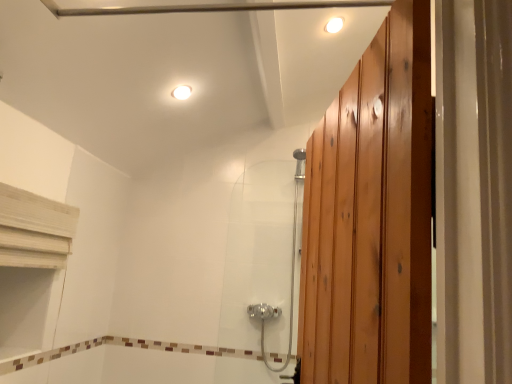
This screenshot has width=512, height=384. What do you see at coordinates (181, 92) in the screenshot? I see `white glossy light fixture at upper center, which ranks as the second light fixture in top-to-bottom order` at bounding box center [181, 92].

What do you see at coordinates (334, 25) in the screenshot?
I see `white glossy light fixture at upper center, the first light fixture in the right-to-left sequence` at bounding box center [334, 25].

Where is `satin chrome shower door at center`? The width and height of the screenshot is (512, 384). satin chrome shower door at center is located at coordinates (262, 254).

From the image's perspective, is white glossy light fixture at upper center, positioned as the 2th light fixture in right-to-left order, beneath white glossy light fixture at upper center, placed as the second light fixture when sorted from left to right?

Correct, white glossy light fixture at upper center, positioned as the 2th light fixture in right-to-left order, appears lower than white glossy light fixture at upper center, placed as the second light fixture when sorted from left to right, in the image.

Could you tell me if white glossy light fixture at upper center, which is counted as the 1th light fixture, starting from the left, is facing white glossy light fixture at upper center, the 2th light fixture in the bottom-to-top sequence?

No, white glossy light fixture at upper center, which is counted as the 1th light fixture, starting from the left, does not turn towards white glossy light fixture at upper center, the 2th light fixture in the bottom-to-top sequence.

Who is taller, white glossy light fixture at upper center, which is counted as the 1th light fixture, starting from the left, or white glossy light fixture at upper center, the first light fixture in the right-to-left sequence?

white glossy light fixture at upper center, which is counted as the 1th light fixture, starting from the left, is taller.

Considering the sizes of white glossy light fixture at upper center, which ranks as the second light fixture in top-to-bottom order, and white glossy light fixture at upper center, placed as the second light fixture when sorted from left to right, in the image, is white glossy light fixture at upper center, which ranks as the second light fixture in top-to-bottom order, wider or thinner than white glossy light fixture at upper center, placed as the second light fixture when sorted from left to right,?

Clearly, white glossy light fixture at upper center, which ranks as the second light fixture in top-to-bottom order, has more width compared to white glossy light fixture at upper center, placed as the second light fixture when sorted from left to right.

Is white glossy light fixture at upper center, placed as the 1th light fixture when sorted from bottom to top, closer to the viewer compared to satin chrome shower door at center?

That is True.

From a real-world perspective, is white glossy light fixture at upper center, which is counted as the 1th light fixture, starting from the left, above or below satin chrome shower door at center?

white glossy light fixture at upper center, which is counted as the 1th light fixture, starting from the left, is situated higher than satin chrome shower door at center in the real world.

Does white glossy light fixture at upper center, positioned as the 2th light fixture in right-to-left order, turn towards satin chrome shower door at center?

No, white glossy light fixture at upper center, positioned as the 2th light fixture in right-to-left order, is not aimed at satin chrome shower door at center.

Find the location of a particular element. Image resolution: width=512 pixels, height=384 pixels. shower door lying on the right of white glossy light fixture at upper center, which is counted as the 1th light fixture, starting from the left is located at coordinates (262, 254).

From a real-world perspective, is satin chrome shower door at center positioned over white glossy light fixture at upper center, positioned as the 2th light fixture in right-to-left order, based on gravity?

No, from a real-world perspective, satin chrome shower door at center is not over white glossy light fixture at upper center, positioned as the 2th light fixture in right-to-left order

What are the coordinates of `shower door behind the white glossy light fixture at upper center, placed as the 1th light fixture when sorted from bottom to top` in the screenshot? It's located at (262, 254).

Is satin chrome shower door at center wider or thinner than white glossy light fixture at upper center, which ranks as the second light fixture in top-to-bottom order?

Clearly, satin chrome shower door at center has more width compared to white glossy light fixture at upper center, which ranks as the second light fixture in top-to-bottom order.

Could you tell me if satin chrome shower door at center is facing white glossy light fixture at upper center, marked as the first light fixture in a top-to-bottom arrangement?

No, satin chrome shower door at center is not turned towards white glossy light fixture at upper center, marked as the first light fixture in a top-to-bottom arrangement.

Looking at the image, does satin chrome shower door at center seem bigger or smaller compared to white glossy light fixture at upper center, marked as the first light fixture in a top-to-bottom arrangement?

Clearly, satin chrome shower door at center is larger in size than white glossy light fixture at upper center, marked as the first light fixture in a top-to-bottom arrangement.

How much distance is there between satin chrome shower door at center and white glossy light fixture at upper center, the 2th light fixture in the bottom-to-top sequence?

4.35 feet.

Between white glossy light fixture at upper center, the 2th light fixture in the bottom-to-top sequence, and white glossy light fixture at upper center, which ranks as the second light fixture in top-to-bottom order, which one has more height?

white glossy light fixture at upper center, which ranks as the second light fixture in top-to-bottom order, is taller.

Looking at this image, which object is thinner, white glossy light fixture at upper center, placed as the second light fixture when sorted from left to right, or white glossy light fixture at upper center, which is counted as the 1th light fixture, starting from the left?

Thinner between the two is white glossy light fixture at upper center, placed as the second light fixture when sorted from left to right.

How distant is white glossy light fixture at upper center, placed as the second light fixture when sorted from left to right, from white glossy light fixture at upper center, which is counted as the 1th light fixture, starting from the left?

The distance of white glossy light fixture at upper center, placed as the second light fixture when sorted from left to right, from white glossy light fixture at upper center, which is counted as the 1th light fixture, starting from the left, is 30.17 inches.

Would you say white glossy light fixture at upper center, the 2th light fixture in the bottom-to-top sequence, contains white glossy light fixture at upper center, which ranks as the second light fixture in top-to-bottom order?

That's incorrect, white glossy light fixture at upper center, which ranks as the second light fixture in top-to-bottom order, is not inside white glossy light fixture at upper center, the 2th light fixture in the bottom-to-top sequence.

From a real-world perspective, which object stands above the other?

white glossy light fixture at upper center, marked as the first light fixture in a top-to-bottom arrangement, from a real-world perspective.

Is point (338, 27) behind point (256, 279)?

No, (338, 27) is closer to viewer.

Considering the relative sizes of white glossy light fixture at upper center, the first light fixture in the right-to-left sequence, and satin chrome shower door at center in the image provided, is white glossy light fixture at upper center, the first light fixture in the right-to-left sequence, wider than satin chrome shower door at center?

In fact, white glossy light fixture at upper center, the first light fixture in the right-to-left sequence, might be narrower than satin chrome shower door at center.

Where is `light fixture located underneath the white glossy light fixture at upper center, placed as the second light fixture when sorted from left to right (from a real-world perspective)`? This screenshot has width=512, height=384. light fixture located underneath the white glossy light fixture at upper center, placed as the second light fixture when sorted from left to right (from a real-world perspective) is located at coordinates (181, 92).

Starting from the satin chrome shower door at center, which light fixture is the 1st one in front? Please provide its 2D coordinates.

[(181, 92)]

Consider the image. Which object lies further to the anchor point white glossy light fixture at upper center, placed as the 1th light fixture when sorted from bottom to top, white glossy light fixture at upper center, placed as the second light fixture when sorted from left to right, or satin chrome shower door at center?

satin chrome shower door at center.

Estimate the real-world distances between objects in this image. Which object is further from white glossy light fixture at upper center, positioned as the 2th light fixture in right-to-left order, satin chrome shower door at center or white glossy light fixture at upper center, the first light fixture in the right-to-left sequence?

satin chrome shower door at center.

From the image, which object appears to be nearer to white glossy light fixture at upper center, the first light fixture in the right-to-left sequence, white glossy light fixture at upper center, which ranks as the second light fixture in top-to-bottom order, or satin chrome shower door at center?

white glossy light fixture at upper center, which ranks as the second light fixture in top-to-bottom order, is closer to white glossy light fixture at upper center, the first light fixture in the right-to-left sequence.

Looking at the image, which one is located closer to white glossy light fixture at upper center, placed as the second light fixture when sorted from left to right, satin chrome shower door at center or white glossy light fixture at upper center, placed as the 1th light fixture when sorted from bottom to top?

Among the two, white glossy light fixture at upper center, placed as the 1th light fixture when sorted from bottom to top, is located nearer to white glossy light fixture at upper center, placed as the second light fixture when sorted from left to right.

Estimate the real-world distances between objects in this image. Which object is further from satin chrome shower door at center, white glossy light fixture at upper center, the first light fixture in the right-to-left sequence, or white glossy light fixture at upper center, which ranks as the second light fixture in top-to-bottom order?

Among the two, white glossy light fixture at upper center, the first light fixture in the right-to-left sequence, is located further to satin chrome shower door at center.

Which object lies nearer to the anchor point satin chrome shower door at center, white glossy light fixture at upper center, which is counted as the 1th light fixture, starting from the left, or white glossy light fixture at upper center, the 2th light fixture in the bottom-to-top sequence?

white glossy light fixture at upper center, which is counted as the 1th light fixture, starting from the left, is closer to satin chrome shower door at center.

Locate an element on the screen. light fixture that lies between white glossy light fixture at upper center, the first light fixture in the right-to-left sequence, and satin chrome shower door at center from top to bottom is located at coordinates (181, 92).